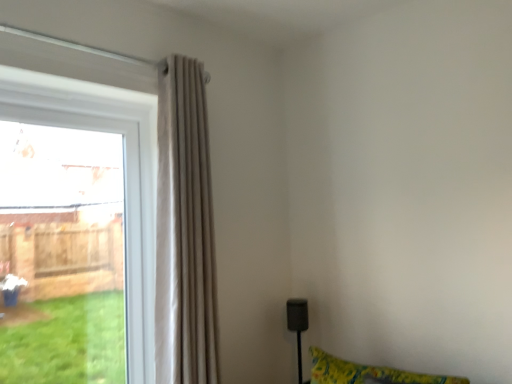
Question: Is clear glass window at left wider or thinner than beige fabric curtain at left?

Choices:
 (A) thin
 (B) wide

Answer: (A)

Question: In the image, is clear glass window at left on the left side or the right side of beige fabric curtain at left?

Choices:
 (A) right
 (B) left

Answer: (B)

Question: From their relative heights in the image, would you say clear glass window at left is taller or shorter than beige fabric curtain at left?

Choices:
 (A) tall
 (B) short

Answer: (B)

Question: Is beige fabric curtain at left in front of or behind clear glass window at left in the image?

Choices:
 (A) front
 (B) behind

Answer: (A)

Question: Is point coord(205,208) closer or farther from the camera than point coord(36,67)?

Choices:
 (A) closer
 (B) farther

Answer: (B)

Question: Choose the correct answer: Is beige fabric curtain at left inside clear glass window at left or outside it?

Choices:
 (A) outside
 (B) inside

Answer: (A)

Question: From the image's perspective, is beige fabric curtain at left located above or below clear glass window at left?

Choices:
 (A) below
 (B) above

Answer: (B)